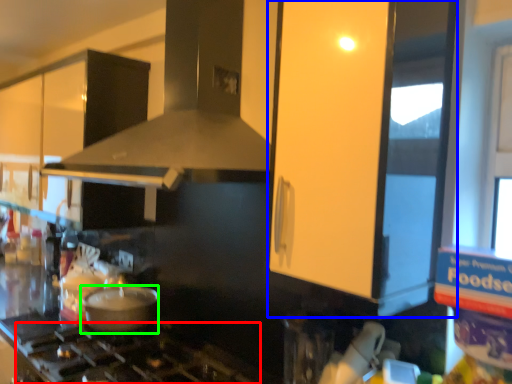
Question: Considering the real-world distances, which object is farthest from gas stove (highlighted by a red box)? glass door (highlighted by a blue box) or kitchen appliance (highlighted by a green box)?

Choices:
 (A) glass door
 (B) kitchen appliance

Answer: (A)